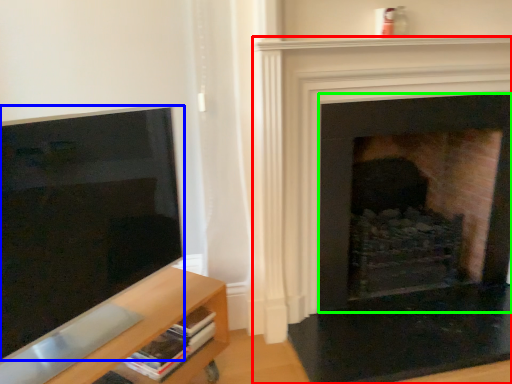
Question: Considering the real-world distances, which object is farthest from fireplace (highlighted by a red box)? screen (highlighted by a blue box) or fireplace (highlighted by a green box)?

Choices:
 (A) screen
 (B) fireplace

Answer: (A)